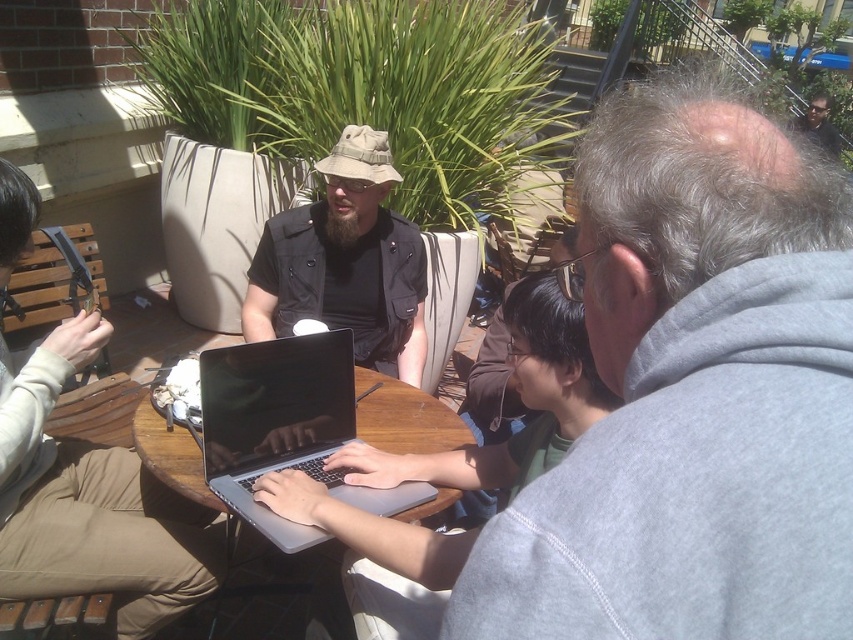
Is matte black vest at center above shiny black sunglasses at upper right?

Incorrect, matte black vest at center is not positioned above shiny black sunglasses at upper right.

Is matte black vest at center taller than shiny black sunglasses at upper right?

No.

Who is more distant from viewer, (x=294, y=289) or (x=807, y=124)?

Positioned behind is point (x=807, y=124).

The height and width of the screenshot is (640, 853). What are the coordinates of `matte black vest at center` in the screenshot? It's located at 345,262.

Does silver metallic laptop at center come in front of shiny black sunglasses at upper right?

Yes, it is.

The width and height of the screenshot is (853, 640). What do you see at coordinates (285, 428) in the screenshot?
I see `silver metallic laptop at center` at bounding box center [285, 428].

Identify the location of silver metallic laptop at center. Image resolution: width=853 pixels, height=640 pixels. (285, 428).

Can you confirm if matte black vest at center is shorter than silver metallic laptop at center?

No, matte black vest at center is not shorter than silver metallic laptop at center.

Does matte black vest at center appear over silver metallic laptop at center?

Indeed, matte black vest at center is positioned over silver metallic laptop at center.

The image size is (853, 640). Identify the location of matte black vest at center. (345, 262).

Where is `matte black vest at center`? Image resolution: width=853 pixels, height=640 pixels. matte black vest at center is located at coordinates (345, 262).